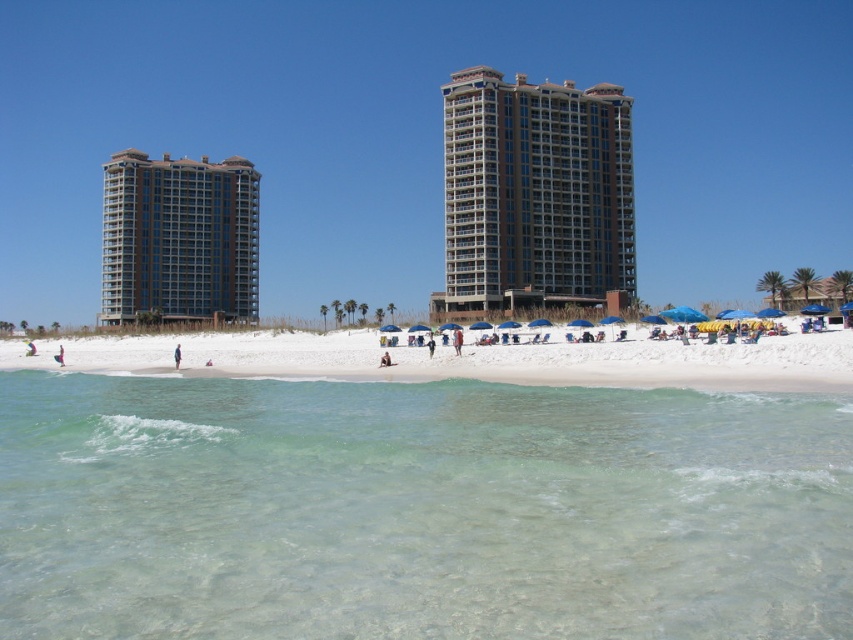
Is blue fabric person at center wider than rainbow-colored kite at lower left?

Incorrect, blue fabric person at center's width does not surpass rainbow-colored kite at lower left's.

Is blue fabric person at center shorter than rainbow-colored kite at lower left?

Incorrect, blue fabric person at center's height does not fall short of rainbow-colored kite at lower left's.

Where is `blue fabric person at center`? Image resolution: width=853 pixels, height=640 pixels. blue fabric person at center is located at coordinates [x=177, y=356].

Does clear water at lower center have a lesser height compared to rainbow-colored kite at lower left?

Incorrect, clear water at lower center's height does not fall short of rainbow-colored kite at lower left's.

At what (x,y) coordinates should I click in order to perform the action: click on clear water at lower center. Please return your answer as a coordinate pair (x, y). Looking at the image, I should click on (418, 509).

Who is positioned more to the right, brown glassy building at center or rainbow-colored kite at lower left?

brown glassy building at center

Between brown glassy building at center and rainbow-colored kite at lower left, which one is positioned higher?

brown glassy building at center is above.

The width and height of the screenshot is (853, 640). What are the coordinates of `brown glassy building at center` in the screenshot? It's located at (535, 193).